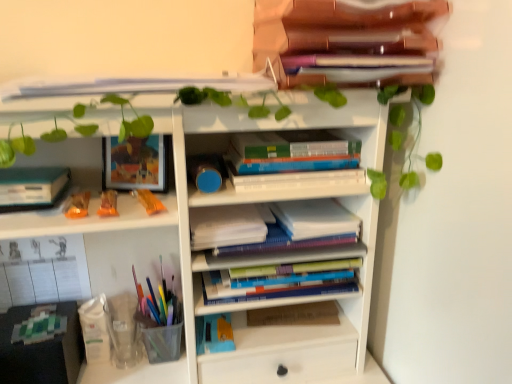
Question: Is translucent orange candy at left, the first toy positioned from the right, in front of hardcover books at center, which appears as the third book when ordered from the bottom?

Choices:
 (A) no
 (B) yes

Answer: (B)

Question: Does translucent orange candy at left, the first toy positioned from the right, contain hardcover books at center, which appears as the third book when ordered from the bottom?

Choices:
 (A) yes
 (B) no

Answer: (B)

Question: From a real-world perspective, does translucent orange candy at left, marked as the 3th toy in a left-to-right arrangement, sit lower than hardcover books at center, which appears as the third book when ordered from the bottom?

Choices:
 (A) yes
 (B) no

Answer: (A)

Question: Does translucent orange candy at left, the first toy positioned from the right, touch hardcover books at center, marked as the 2th book in a top-to-bottom arrangement?

Choices:
 (A) no
 (B) yes

Answer: (A)

Question: Is there a large distance between translucent orange candy at left, marked as the 3th toy in a left-to-right arrangement, and hardcover books at center, which appears as the third book when ordered from the bottom?

Choices:
 (A) yes
 (B) no

Answer: (B)

Question: Is hardcover books at center, which appears as the third book when ordered from the bottom, to the left or to the right of white matte bookshelf at center in the image?

Choices:
 (A) right
 (B) left

Answer: (A)

Question: Considering their positions, is hardcover books at center, marked as the 2th book in a top-to-bottom arrangement, located in front of or behind white matte bookshelf at center?

Choices:
 (A) front
 (B) behind

Answer: (B)

Question: From a real-world perspective, is hardcover books at center, marked as the 2th book in a top-to-bottom arrangement, physically located above or below white matte bookshelf at center?

Choices:
 (A) above
 (B) below

Answer: (B)

Question: Considering the positions of hardcover books at center, which appears as the third book when ordered from the bottom, and white matte bookshelf at center in the image, is hardcover books at center, which appears as the third book when ordered from the bottom, wider or thinner than white matte bookshelf at center?

Choices:
 (A) wide
 (B) thin

Answer: (A)

Question: In terms of height, does white paper at center, marked as the second paperback book in a bottom-to-top arrangement, look taller or shorter compared to hardcover books at center, which is counted as the 1th book, starting from the bottom?

Choices:
 (A) tall
 (B) short

Answer: (A)

Question: Is white paper at center, marked as the second paperback book in a bottom-to-top arrangement, in front of or behind hardcover books at center, positioned as the fourth book in top-to-bottom order, in the image?

Choices:
 (A) behind
 (B) front

Answer: (B)

Question: Is point (199, 231) closer or farther from the camera than point (335, 261)?

Choices:
 (A) farther
 (B) closer

Answer: (B)

Question: Is white paper at center, which is the third paperback book from right to left, bigger or smaller than hardcover books at center, positioned as the fourth book in top-to-bottom order?

Choices:
 (A) small
 (B) big

Answer: (A)

Question: From a real-world perspective, is wooden folder at upper center, arranged as the 4th book when ordered from the bottom, above or below white matte bookshelf at center?

Choices:
 (A) above
 (B) below

Answer: (A)

Question: Considering their positions, is wooden folder at upper center, the 1th book when ordered from top to bottom, located in front of or behind white matte bookshelf at center?

Choices:
 (A) behind
 (B) front

Answer: (A)